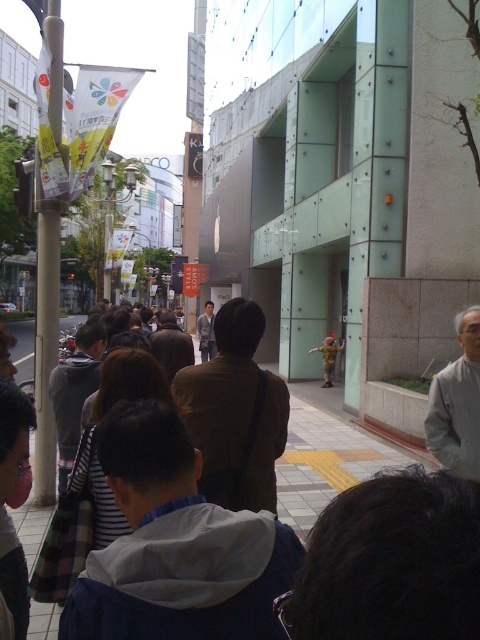
Which is in front, point (327, 465) or point (456, 384)?

Point (456, 384) is in front.

Does smooth concrete pavement at center have a lesser width compared to gray fabric jacket at lower right?

Incorrect, smooth concrete pavement at center's width is not less than gray fabric jacket at lower right's.

Is point (310, 422) farther from viewer compared to point (477, 374)?

Yes, point (310, 422) is behind point (477, 374).

Where is `smooth concrete pavement at center`? This screenshot has width=480, height=640. smooth concrete pavement at center is located at coordinates (325, 458).